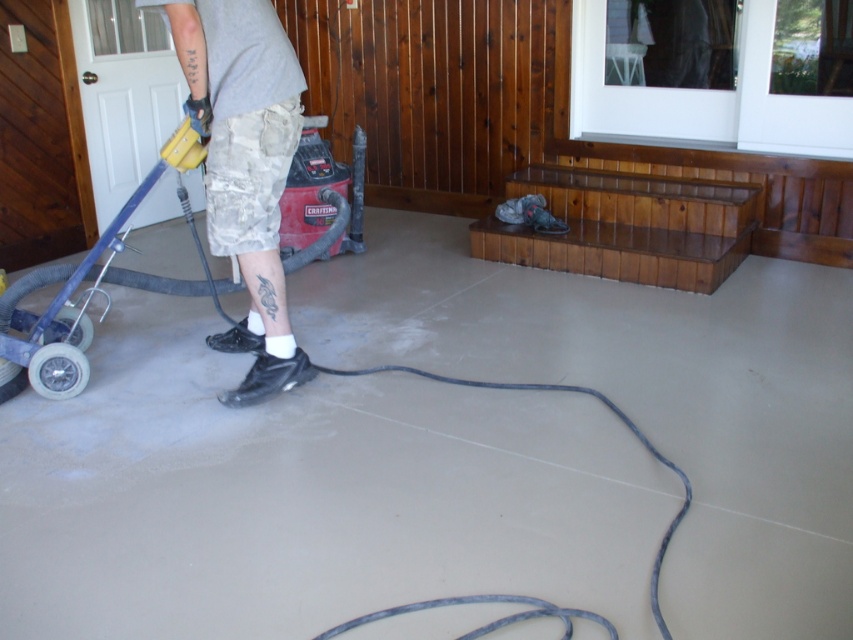
Question: Observing the image, what is the correct spatial positioning of smooth concrete floor at center in reference to camouflage shorts at left?

Choices:
 (A) above
 (B) below

Answer: (B)

Question: Which object appears farthest from the camera in this image?

Choices:
 (A) smooth concrete floor at center
 (B) camouflage shorts at left

Answer: (B)

Question: Which object appears closest to the camera in this image?

Choices:
 (A) smooth concrete floor at center
 (B) camouflage shorts at left

Answer: (A)

Question: Can you confirm if smooth concrete floor at center is bigger than camouflage shorts at left?

Choices:
 (A) no
 (B) yes

Answer: (B)

Question: Is smooth concrete floor at center closer to camera compared to camouflage shorts at left?

Choices:
 (A) yes
 (B) no

Answer: (A)

Question: Which point is farther from the camera taking this photo?

Choices:
 (A) (514, 396)
 (B) (256, 248)

Answer: (A)